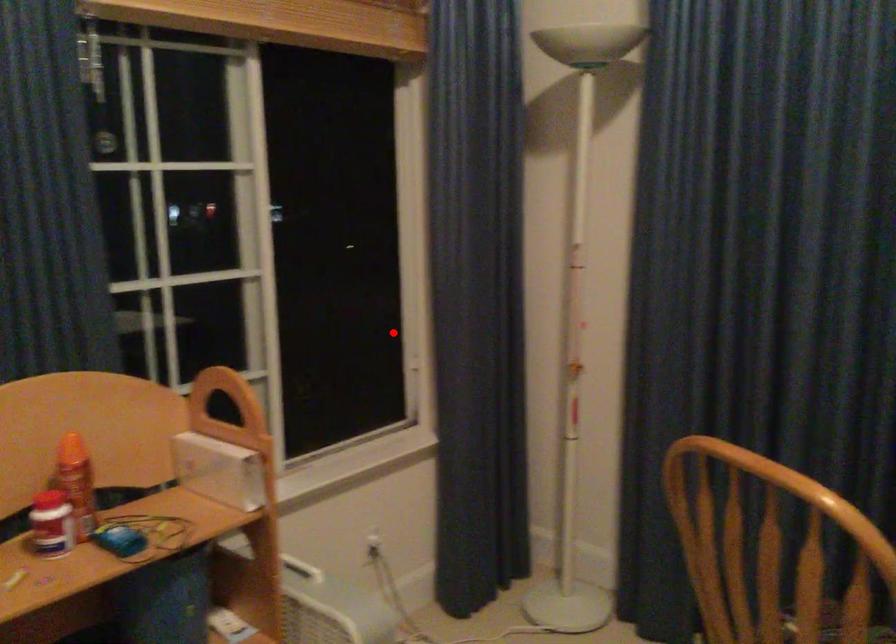
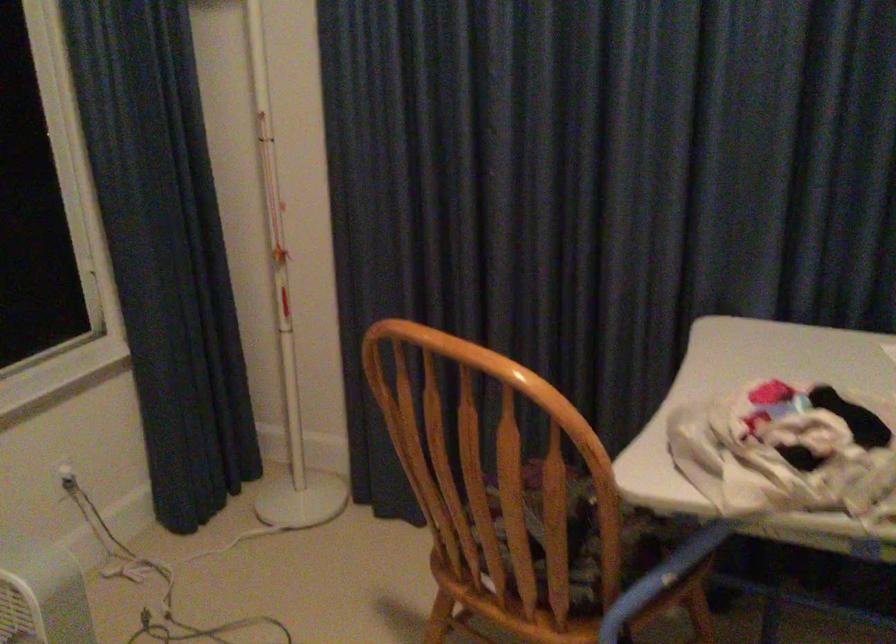
Find the pixel in the second image that matches the highlighted location in the first image.

(66, 230)